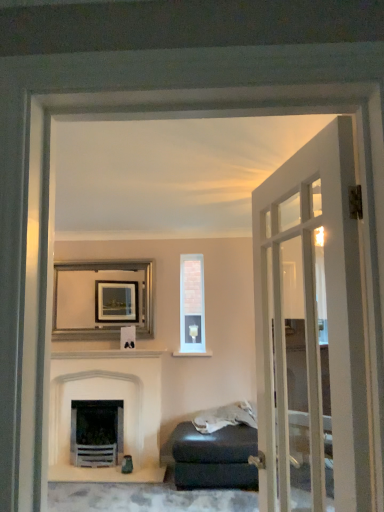
Question: Considering the relative sizes of clear glass window at center and matte black ottoman at lower right in the image provided, is clear glass window at center shorter than matte black ottoman at lower right?

Choices:
 (A) no
 (B) yes

Answer: (A)

Question: Does clear glass window at center have a greater width compared to matte black ottoman at lower right?

Choices:
 (A) no
 (B) yes

Answer: (A)

Question: Is clear glass window at center facing towards matte black ottoman at lower right?

Choices:
 (A) no
 (B) yes

Answer: (A)

Question: From the image's perspective, is clear glass window at center on top of matte black ottoman at lower right?

Choices:
 (A) no
 (B) yes

Answer: (B)

Question: Is clear glass window at center positioned far away from matte black ottoman at lower right?

Choices:
 (A) yes
 (B) no

Answer: (B)

Question: Is clear glass window at center not within matte black ottoman at lower right?

Choices:
 (A) yes
 (B) no

Answer: (A)

Question: From the image's perspective, does clear glass window at center appear higher than silver metallic picture frame at upper center?

Choices:
 (A) yes
 (B) no

Answer: (B)

Question: Is clear glass window at center thinner than silver metallic picture frame at upper center?

Choices:
 (A) yes
 (B) no

Answer: (B)

Question: From the image's perspective, is clear glass window at center below silver metallic picture frame at upper center?

Choices:
 (A) yes
 (B) no

Answer: (A)

Question: Is clear glass window at center wider than silver metallic picture frame at upper center?

Choices:
 (A) no
 (B) yes

Answer: (B)

Question: Is clear glass window at center taller than silver metallic picture frame at upper center?

Choices:
 (A) yes
 (B) no

Answer: (A)

Question: Could silver metallic picture frame at upper center be considered to be inside clear glass window at center?

Choices:
 (A) yes
 (B) no

Answer: (B)

Question: Can you confirm if matte black ottoman at lower right is positioned to the left of white glass door at right?

Choices:
 (A) no
 (B) yes

Answer: (B)